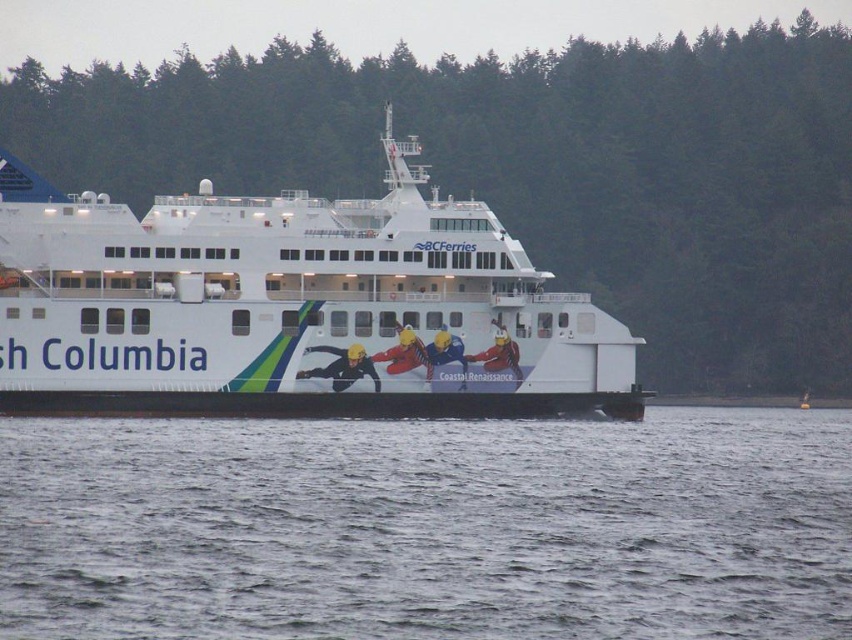
You are standing on the dock and looking at the gray water at lower center and the white matte ferry at center. Which object is closer to you from your perspective?

The gray water at lower center is positioned under the white matte ferry at center, so the gray water at lower center is closer to you.